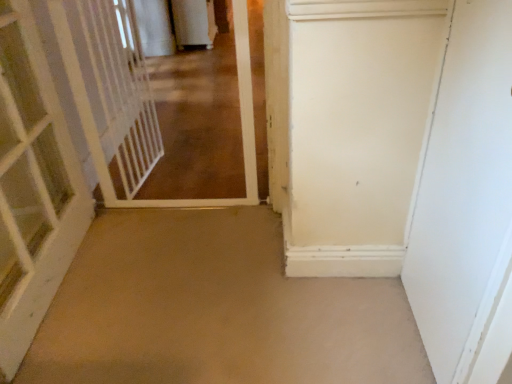
Where is `white wooden door at left, the 2th door viewed from the right`? Image resolution: width=512 pixels, height=384 pixels. white wooden door at left, the 2th door viewed from the right is located at coordinates (33, 186).

You are a GUI agent. You are given a task and a screenshot of the screen. Output one action in this format:
    pyautogui.click(x=<x>, y=<y>)
    Task: Click on the white plastic gate at left
    This screenshot has width=512, height=384.
    Given the screenshot: What is the action you would take?
    pyautogui.click(x=113, y=93)

Describe the element at coordinates (467, 204) in the screenshot. This screenshot has width=512, height=384. I see `white matte door at right, which is counted as the second door, starting from the left` at that location.

The image size is (512, 384). What do you see at coordinates (241, 132) in the screenshot?
I see `white glossy gate at upper left` at bounding box center [241, 132].

The width and height of the screenshot is (512, 384). I want to click on white wooden door at left, the 2th door viewed from the right, so click(33, 186).

Measure the distance from white wooden door at left, marked as the first door in a left-to-right arrangement, to white matte door at right, which is the first door from right to left.

white wooden door at left, marked as the first door in a left-to-right arrangement, and white matte door at right, which is the first door from right to left, are 4.23 feet apart.

Which point is more forward, (x=0, y=257) or (x=483, y=276)?

The point (x=483, y=276) is more forward.

Is white wooden door at left, the 2th door viewed from the right, located outside white matte door at right, which is counted as the second door, starting from the left?

Yes, white wooden door at left, the 2th door viewed from the right, is not within white matte door at right, which is counted as the second door, starting from the left.

Would you consider white plastic gate at left to be distant from beige carpet at center?

Actually, white plastic gate at left and beige carpet at center are a little close together.

From the image's perspective, who appears lower, white plastic gate at left or beige carpet at center?

beige carpet at center is shown below in the image.

The image size is (512, 384). What are the coordinates of `concrete on the right of white plastic gate at left` in the screenshot? It's located at (215, 310).

Is white wooden door at left, marked as the first door in a left-to-right arrangement, wider or thinner than white glossy gate at upper left?

In the image, white wooden door at left, marked as the first door in a left-to-right arrangement, appears to be more narrow than white glossy gate at upper left.

Is white wooden door at left, the 2th door viewed from the right, directly adjacent to white glossy gate at upper left?

white wooden door at left, the 2th door viewed from the right, and white glossy gate at upper left are clearly separated.

Based on their sizes in the image, would you say white wooden door at left, marked as the first door in a left-to-right arrangement, is bigger or smaller than white glossy gate at upper left?

In the image, white wooden door at left, marked as the first door in a left-to-right arrangement, appears to be larger than white glossy gate at upper left.

From a real-world perspective, which object stands above the other?

From a 3D spatial view, white wooden door at left, marked as the first door in a left-to-right arrangement, is above.

Is beige carpet at center at the back of white wooden door at left, marked as the first door in a left-to-right arrangement?

white wooden door at left, marked as the first door in a left-to-right arrangement, is not turned away from beige carpet at center.

Can you confirm if white wooden door at left, the 2th door viewed from the right, is bigger than beige carpet at center?

Correct, white wooden door at left, the 2th door viewed from the right, is larger in size than beige carpet at center.

Can you tell me how much white wooden door at left, the 2th door viewed from the right, and beige carpet at center differ in facing direction?

87.5 degrees.

Can you confirm if white matte door at right, which is counted as the second door, starting from the left, is positioned to the left of beige carpet at center?

No.

Does white matte door at right, which is counted as the second door, starting from the left, have a greater width compared to beige carpet at center?

Incorrect, the width of white matte door at right, which is counted as the second door, starting from the left, does not surpass that of beige carpet at center.

Is white matte door at right, which is the first door from right to left, outside of beige carpet at center?

Yes, white matte door at right, which is the first door from right to left, is outside of beige carpet at center.

Find the location of a particular element. The image size is (512, 384). door located on the right of beige carpet at center is located at coordinates (467, 204).

Does white glossy gate at upper left appear on the right side of white plastic gate at left?

Indeed, white glossy gate at upper left is positioned on the right side of white plastic gate at left.

Is point (241, 93) more distant than point (148, 132)?

No.

From a real-world perspective, which object stands above the other?

white plastic gate at left.

Which object is positioned more to the left, white glossy gate at upper left or white matte door at right, which is the first door from right to left?

white glossy gate at upper left is more to the left.

Considering the sizes of objects white glossy gate at upper left and white matte door at right, which is counted as the second door, starting from the left, in the image provided, who is bigger, white glossy gate at upper left or white matte door at right, which is counted as the second door, starting from the left,?

With larger size is white matte door at right, which is counted as the second door, starting from the left.

Does white glossy gate at upper left touch white matte door at right, which is the first door from right to left?

No, white glossy gate at upper left is not in contact with white matte door at right, which is the first door from right to left.

Is white glossy gate at upper left turned away from white matte door at right, which is the first door from right to left?

white glossy gate at upper left is not turned away from white matte door at right, which is the first door from right to left.

Locate an element on the screen. The image size is (512, 384). door that is above the white wooden door at left, the 2th door viewed from the right (from a real-world perspective) is located at coordinates (467, 204).

Locate an element on the screen. This screenshot has height=384, width=512. elevator on the left of beige carpet at center is located at coordinates (113, 93).

Based on their spatial positions, is beige carpet at center or white matte door at right, which is counted as the second door, starting from the left, closer to white glossy gate at upper left?

beige carpet at center is positioned closer to the anchor white glossy gate at upper left.

Looking at the image, which one is located closer to beige carpet at center, white matte door at right, which is counted as the second door, starting from the left, or white wooden door at left, marked as the first door in a left-to-right arrangement?

white wooden door at left, marked as the first door in a left-to-right arrangement, is closer to beige carpet at center.

Which object lies further to the anchor point white wooden door at left, the 2th door viewed from the right, white plastic gate at left or white glossy gate at upper left?

white glossy gate at upper left lies further to white wooden door at left, the 2th door viewed from the right, than the other object.

Based on their spatial positions, is white wooden door at left, marked as the first door in a left-to-right arrangement, or white glossy gate at upper left further from beige carpet at center?

The object further to beige carpet at center is white glossy gate at upper left.

Looking at the image, which one is located closer to beige carpet at center, white plastic gate at left or white glossy gate at upper left?

white glossy gate at upper left lies closer to beige carpet at center than the other object.

Considering their positions, is white wooden door at left, marked as the first door in a left-to-right arrangement, positioned closer to white plastic gate at left than beige carpet at center?

The object closer to white plastic gate at left is white wooden door at left, marked as the first door in a left-to-right arrangement.

From the image, which object appears to be nearer to white glossy gate at upper left, white wooden door at left, the 2th door viewed from the right, or white plastic gate at left?

Based on the image, white plastic gate at left appears to be nearer to white glossy gate at upper left.

Estimate the real-world distances between objects in this image. Which object is further from white wooden door at left, the 2th door viewed from the right, white glossy gate at upper left or white plastic gate at left?

Among the two, white glossy gate at upper left is located further to white wooden door at left, the 2th door viewed from the right.

The height and width of the screenshot is (384, 512). In order to click on concrete located between white wooden door at left, the 2th door viewed from the right, and white plastic gate at left in the depth direction in this screenshot , I will do `click(215, 310)`.

Locate an element on the screen. The height and width of the screenshot is (384, 512). concrete between white glossy gate at upper left and white matte door at right, which is counted as the second door, starting from the left is located at coordinates (215, 310).

The height and width of the screenshot is (384, 512). Find the location of `corridor between white plastic gate at left and beige carpet at center in the vertical direction`. corridor between white plastic gate at left and beige carpet at center in the vertical direction is located at coordinates (241, 132).

I want to click on corridor between white plastic gate at left and white matte door at right, which is the first door from right to left, from left to right, so click(x=241, y=132).